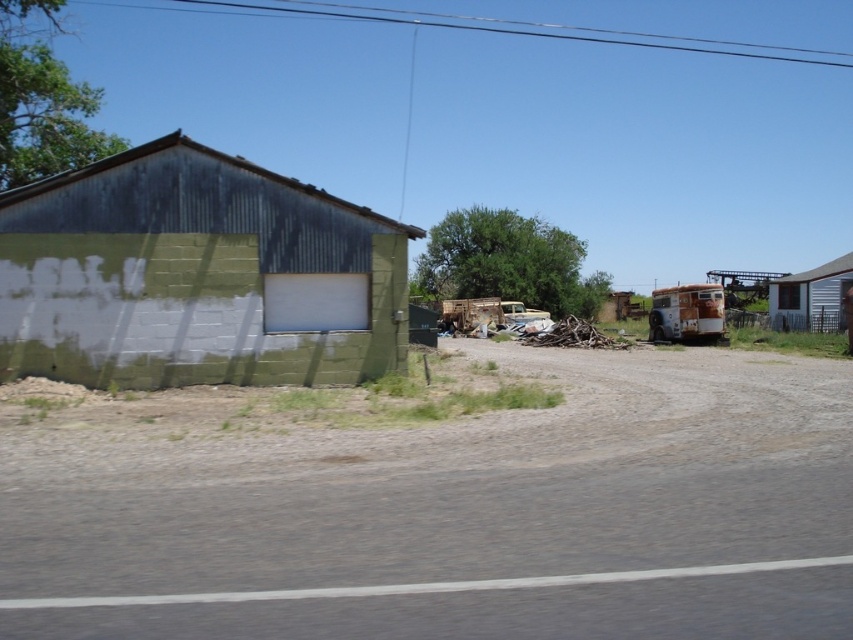
Question: Considering the real-world distances, which object is farthest from the dirt/gravel road at center?

Choices:
 (A) white wood cabin at right
 (B) green corrugated metal building at left

Answer: (A)

Question: Which object appears closest to the camera in this image?

Choices:
 (A) green corrugated metal building at left
 (B) white wood cabin at right
 (C) dirt/gravel road at center

Answer: (C)

Question: Can you confirm if dirt/gravel road at center is positioned to the right of white wood cabin at right?

Choices:
 (A) no
 (B) yes

Answer: (A)

Question: Which object is farther from the camera taking this photo?

Choices:
 (A) white wood cabin at right
 (B) green corrugated metal building at left
 (C) dirt/gravel road at center

Answer: (A)

Question: Is dirt/gravel road at center closer to camera compared to white wood cabin at right?

Choices:
 (A) no
 (B) yes

Answer: (B)

Question: Is dirt/gravel road at center bigger than white wood cabin at right?

Choices:
 (A) yes
 (B) no

Answer: (B)